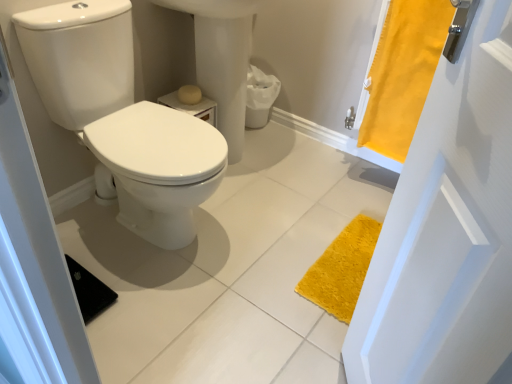
Where is `free location to the right of white glossy sink at center`? free location to the right of white glossy sink at center is located at coordinates point(307,174).